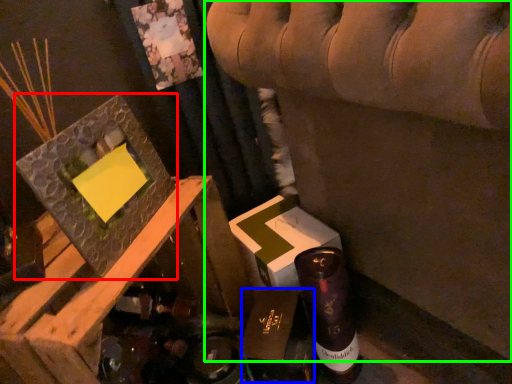
Question: Estimate the real-world distances between objects in this image. Which object is farther from picture frame (highlighted by a red box), cardboard box (highlighted by a blue box) or furniture (highlighted by a green box)?

Choices:
 (A) cardboard box
 (B) furniture

Answer: (B)